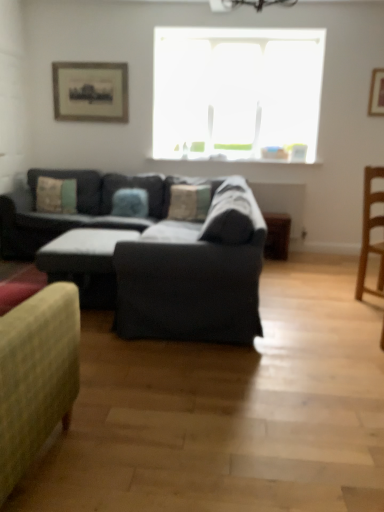
I want to click on textured fabric pillow at center, the 3th pillow when ordered from left to right, so click(189, 202).

Describe the element at coordinates (90, 91) in the screenshot. This screenshot has height=512, width=384. I see `wooden framed print at upper left, positioned as the 1th picture frame in back-to-front order` at that location.

What is the approximate height of dark gray fabric couch at center?

It is 32.93 inches.

This screenshot has width=384, height=512. Identify the location of wooden side table at lower right. (277, 236).

Are blue fabric pillow at center, which appears as the 2th pillow when viewed from the right, and dark gray fabric couch at center beside each other?

No, blue fabric pillow at center, which appears as the 2th pillow when viewed from the right, is not beside dark gray fabric couch at center.

Starting from the dark gray fabric couch at center, which pillow is the 2nd one to the left? Please provide its 2D coordinates.

[(130, 203)]

From the picture: Is blue fabric pillow at center, which is the 2th pillow in left-to-right order, aimed at dark gray fabric couch at center?

No.

In the scene shown: From the image's perspective, which one is positioned higher, blue fabric pillow at center, which is the 2th pillow in left-to-right order, or dark gray fabric couch at center?

blue fabric pillow at center, which is the 2th pillow in left-to-right order, is shown above in the image.

Could you tell me if light brown wooden chair at right is turned towards transparent glass window at upper center?

No, light brown wooden chair at right does not turn towards transparent glass window at upper center.

Is light brown wooden chair at right not near transparent glass window at upper center?

That's right, there is a large distance between light brown wooden chair at right and transparent glass window at upper center.

Between light brown wooden chair at right and transparent glass window at upper center, which one is positioned in front?

light brown wooden chair at right is closer to the camera.

From a real-world perspective, does light brown wooden chair at right sit lower than transparent glass window at upper center?

Correct, in the physical world, light brown wooden chair at right is lower than transparent glass window at upper center.

Locate an element on the screen. The height and width of the screenshot is (512, 384). chair below the transparent glass window at upper center (from the image's perspective) is located at coordinates (369, 234).

From a real-world perspective, does transparent glass window at upper center sit lower than light brown wooden chair at right?

No.

Is transparent glass window at upper center situated inside light brown wooden chair at right or outside?

transparent glass window at upper center is outside light brown wooden chair at right.

Identify the location of picture frame that is the 1st one when counting upward from the blue fabric pillow at center, which appears as the 2th pillow when viewed from the right (from the image's perspective). The width and height of the screenshot is (384, 512). coord(376,93).

Is wooden picture frame at upper right, positioned as the 2th picture frame in back-to-front order, placed right next to blue fabric pillow at center, which is the 2th pillow in left-to-right order?

There is a gap between wooden picture frame at upper right, positioned as the 2th picture frame in back-to-front order, and blue fabric pillow at center, which is the 2th pillow in left-to-right order.

Is blue fabric pillow at center, which is the 2th pillow in left-to-right order, surrounded by wooden picture frame at upper right, positioned as the 2th picture frame in back-to-front order?

→ No, blue fabric pillow at center, which is the 2th pillow in left-to-right order, is not a part of wooden picture frame at upper right, positioned as the 2th picture frame in back-to-front order.

Is wooden picture frame at upper right, positioned as the 2th picture frame in back-to-front order, taller than blue fabric pillow at center, which is the 2th pillow in left-to-right order?

Indeed, wooden picture frame at upper right, positioned as the 2th picture frame in back-to-front order, has a greater height compared to blue fabric pillow at center, which is the 2th pillow in left-to-right order.

Could you tell me if transparent glass window at upper center is turned towards wooden side table at lower right?

No, transparent glass window at upper center is not aimed at wooden side table at lower right.

Which of these two, transparent glass window at upper center or wooden side table at lower right, stands taller?

transparent glass window at upper center.

How many degrees apart are the facing directions of transparent glass window at upper center and wooden side table at lower right?

transparent glass window at upper center and wooden side table at lower right are facing 0.852 degrees away from each other.

Where is `window on the left of wooden side table at lower right`? The width and height of the screenshot is (384, 512). window on the left of wooden side table at lower right is located at coordinates (235, 90).

Is textured fabric pillow at center, which ranks as the 1th pillow in right-to-left order, facing away from transparent glass window at upper center?

No, textured fabric pillow at center, which ranks as the 1th pillow in right-to-left order, is not facing away from transparent glass window at upper center.

Starting from the transparent glass window at upper center, which pillow is the 1st one to the left? Please provide its 2D coordinates.

[(189, 202)]

Which is more to the left, textured fabric pillow at center, the 3th pillow when ordered from left to right, or transparent glass window at upper center?

Positioned to the left is textured fabric pillow at center, the 3th pillow when ordered from left to right.

Does textured fabric pillow at center, the 3th pillow when ordered from left to right, have a lesser height compared to transparent glass window at upper center?

Yes.

Is wooden framed print at upper left, positioned as the 1th picture frame in back-to-front order, positioned beyond the bounds of textured beige pillow at left, which ranks as the 1th pillow in left-to-right order?

wooden framed print at upper left, positioned as the 1th picture frame in back-to-front order, is positioned outside textured beige pillow at left, which ranks as the 1th pillow in left-to-right order.

Who is more distant, wooden framed print at upper left, the 2th picture frame in the front-to-back sequence, or textured beige pillow at left, which ranks as the 1th pillow in left-to-right order?

Positioned behind is wooden framed print at upper left, the 2th picture frame in the front-to-back sequence.

Measure the distance from wooden framed print at upper left, placed as the 2th picture frame when sorted from right to left, to textured beige pillow at left, which is counted as the 3th pillow, starting from the right.

wooden framed print at upper left, placed as the 2th picture frame when sorted from right to left, and textured beige pillow at left, which is counted as the 3th pillow, starting from the right, are 3.52 feet apart from each other.

From a real-world perspective, starting from the dark gray fabric couch at center, which pillow is the 1st one vertically above it? Please provide its 2D coordinates.

[(130, 203)]

The height and width of the screenshot is (512, 384). In order to click on chair that is in front of the transparent glass window at upper center in this screenshot , I will do `click(369, 234)`.

Considering their positions, is textured beige pillow at left, which is counted as the 3th pillow, starting from the right, positioned further to textured fabric pillow at center, which ranks as the 1th pillow in right-to-left order, than wooden picture frame at upper right, the 2th picture frame viewed from the left?

Based on the image, wooden picture frame at upper right, the 2th picture frame viewed from the left, appears to be further to textured fabric pillow at center, which ranks as the 1th pillow in right-to-left order.

From the image, which object appears to be nearer to textured beige pillow at left, which is counted as the 3th pillow, starting from the right, wooden side table at lower right or wooden picture frame at upper right, marked as the first picture frame in a right-to-left arrangement?

wooden side table at lower right is positioned closer to the anchor textured beige pillow at left, which is counted as the 3th pillow, starting from the right.

Which object lies nearer to the anchor point transparent glass window at upper center, dark gray fabric couch at center or light brown wooden chair at right?

light brown wooden chair at right.

Estimate the real-world distances between objects in this image. Which object is further from textured beige pillow at left, which is counted as the 3th pillow, starting from the right, wooden side table at lower right or textured fabric pillow at center, which ranks as the 1th pillow in right-to-left order?

wooden side table at lower right is further to textured beige pillow at left, which is counted as the 3th pillow, starting from the right.

Looking at the image, which one is located closer to textured beige pillow at left, which ranks as the 1th pillow in left-to-right order, dark gray fabric couch at center or wooden side table at lower right?

wooden side table at lower right.

Considering their positions, is blue fabric pillow at center, which is the 2th pillow in left-to-right order, positioned further to textured fabric pillow at center, the 3th pillow when ordered from left to right, than transparent glass window at upper center?

Based on the image, transparent glass window at upper center appears to be further to textured fabric pillow at center, the 3th pillow when ordered from left to right.

Looking at the image, which one is located further to textured fabric pillow at center, which ranks as the 1th pillow in right-to-left order, light brown wooden chair at right or wooden picture frame at upper right, marked as the first picture frame in a right-to-left arrangement?

wooden picture frame at upper right, marked as the first picture frame in a right-to-left arrangement, is positioned further to the anchor textured fabric pillow at center, which ranks as the 1th pillow in right-to-left order.

From the image, which object appears to be nearer to dark gray fabric couch at center, wooden framed print at upper left, placed as the 2th picture frame when sorted from right to left, or wooden picture frame at upper right, marked as the first picture frame in a right-to-left arrangement?

Based on the image, wooden framed print at upper left, placed as the 2th picture frame when sorted from right to left, appears to be nearer to dark gray fabric couch at center.

Where is `chair between dark gray fabric couch at center and wooden side table at lower right from front to back`? The height and width of the screenshot is (512, 384). chair between dark gray fabric couch at center and wooden side table at lower right from front to back is located at coordinates (369, 234).

You are a GUI agent. You are given a task and a screenshot of the screen. Output one action in this format:
    pyautogui.click(x=<x>, y=<y>)
    Task: Click on the window between textured beige pillow at left, which ranks as the 1th pillow in left-to-right order, and light brown wooden chair at right, in the horizontal direction
    Image resolution: width=384 pixels, height=512 pixels.
    Given the screenshot: What is the action you would take?
    click(x=235, y=90)

Where is `studio couch between blue fabric pillow at center, which appears as the 2th pillow when viewed from the right, and light brown wooden chair at right`? The image size is (384, 512). studio couch between blue fabric pillow at center, which appears as the 2th pillow when viewed from the right, and light brown wooden chair at right is located at coordinates (154, 258).

You are a GUI agent. You are given a task and a screenshot of the screen. Output one action in this format:
    pyautogui.click(x=<x>, y=<y>)
    Task: Click on the table between wooden picture frame at upper right, positioned as the first picture frame in front-to-back order, and light brown wooden chair at right, in the vertical direction
    Image resolution: width=384 pixels, height=512 pixels.
    Given the screenshot: What is the action you would take?
    pyautogui.click(x=277, y=236)